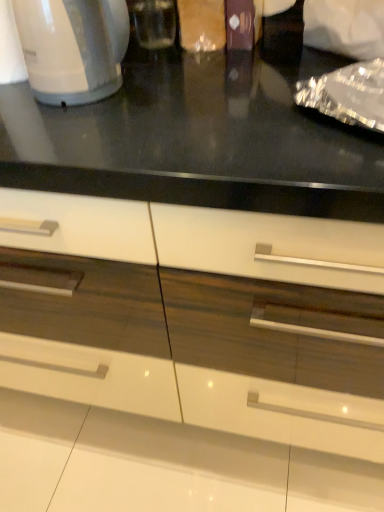
Question: Is white glossy cabinet at center to the left of white glossy electric kettle at left from the viewer's perspective?

Choices:
 (A) no
 (B) yes

Answer: (A)

Question: Considering the relative positions of white glossy cabinet at center and white glossy electric kettle at left in the image provided, is white glossy cabinet at center behind white glossy electric kettle at left?

Choices:
 (A) no
 (B) yes

Answer: (A)

Question: Is white glossy cabinet at center thinner than white glossy electric kettle at left?

Choices:
 (A) yes
 (B) no

Answer: (B)

Question: Considering the relative sizes of white glossy cabinet at center and white glossy electric kettle at left in the image provided, is white glossy cabinet at center taller than white glossy electric kettle at left?

Choices:
 (A) yes
 (B) no

Answer: (A)

Question: Can you confirm if white glossy cabinet at center is bigger than white glossy electric kettle at left?

Choices:
 (A) no
 (B) yes

Answer: (B)

Question: Is white glossy cabinet at center smaller than white glossy electric kettle at left?

Choices:
 (A) no
 (B) yes

Answer: (A)

Question: Is white glossy electric kettle at left positioned beyond the bounds of white glossy cabinet at center?

Choices:
 (A) yes
 (B) no

Answer: (A)

Question: Is white glossy electric kettle at left thinner than white glossy cabinet at center?

Choices:
 (A) no
 (B) yes

Answer: (B)

Question: Is white glossy electric kettle at left closer to the viewer compared to white glossy cabinet at center?

Choices:
 (A) no
 (B) yes

Answer: (A)

Question: Would you say white glossy electric kettle at left is a long distance from white glossy cabinet at center?

Choices:
 (A) yes
 (B) no

Answer: (B)

Question: Are white glossy electric kettle at left and white glossy cabinet at center beside each other?

Choices:
 (A) no
 (B) yes

Answer: (A)

Question: Considering the relative sizes of white glossy electric kettle at left and white glossy cabinet at center in the image provided, is white glossy electric kettle at left taller than white glossy cabinet at center?

Choices:
 (A) no
 (B) yes

Answer: (A)

Question: From their relative heights in the image, would you say white glossy cabinet at center is taller or shorter than white glossy electric kettle at left?

Choices:
 (A) tall
 (B) short

Answer: (A)